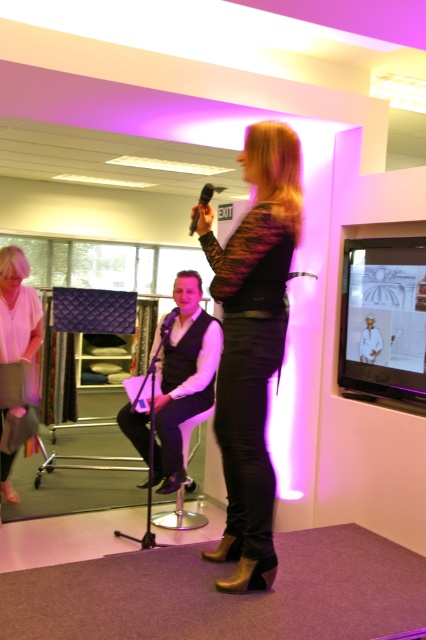
You are standing in the presentation space and want to take a photo of the point at coordinates point (259, 376). Considering the camera you have can focus on objects within 5 feet, will the point be in focus?

The point (259, 376) is 6.18 feet away from the camera, which is beyond the 5 feet focus range. Therefore, the point will not be in focus.

Based on the photo, you are standing in the presentation space and want to place a small table at the point marked as point [167,392]. If the table requires 12 feet of space from the front to avoid blocking the audience view, will this placement work?

The distance of point [167,392] from viewer is 11.82 feet, which is slightly less than the required 12 feet. Therefore, placing the table at this point may block the audience view.

Where is the leopard print sweater at center located in the image?

The leopard print sweater at center is located at point (x=252, y=344) in the image.